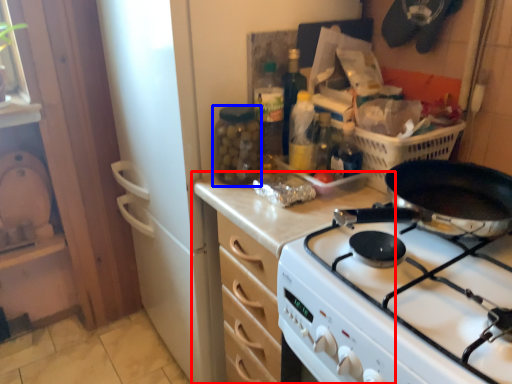
Question: Which of the following is the farthest to the observer, cabinetry (highlighted by a red box) or bottle (highlighted by a blue box)?

Choices:
 (A) cabinetry
 (B) bottle

Answer: (B)